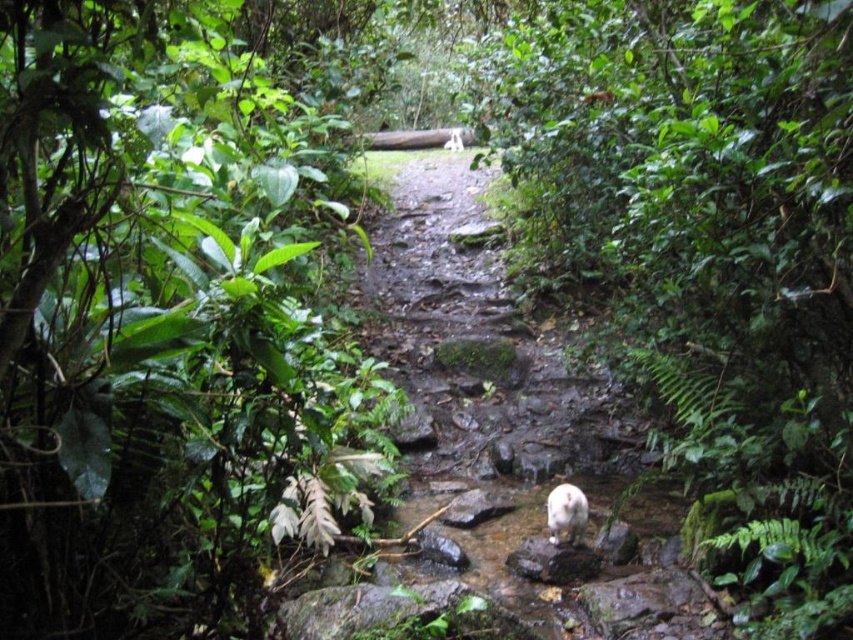
You are a hiker carrying a backpack that is 0.5 meters wide. You come across the narrow path with the green leafy plant at left and the white fur animal at center. Can you pass through the path between them without squeezing?

The green leafy plant at left might be wider than the white fur animal at center, so it is uncertain if the path between them is wide enough for your backpack. You should check the actual width before proceeding.

You are a hiker walking along the narrow, rocky path in the forest. You notice a white fur animal at center and green leafy vegetation at center. Which object is closer to you as you walk forward?

The green leafy vegetation at center is in front of the white fur animal at center, so it is closer to you as you walk forward.